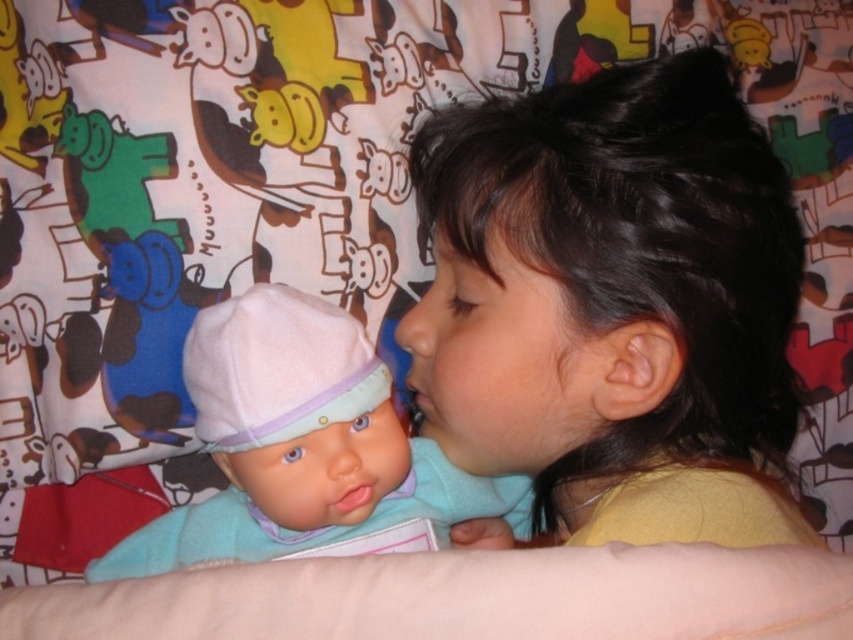
Question: Which point is closer to the camera?

Choices:
 (A) (468, 320)
 (B) (396, 472)

Answer: (A)

Question: Which object is closer to the camera taking this photo?

Choices:
 (A) smooth brown hair at upper right
 (B) matte pink fabric doll at left

Answer: (A)

Question: Can you confirm if smooth brown hair at upper right is smaller than matte pink fabric doll at left?

Choices:
 (A) no
 (B) yes

Answer: (A)

Question: Is smooth brown hair at upper right below matte pink fabric doll at left?

Choices:
 (A) yes
 (B) no

Answer: (B)

Question: Can you confirm if smooth brown hair at upper right is positioned to the left of matte pink fabric doll at left?

Choices:
 (A) no
 (B) yes

Answer: (A)

Question: Among these points, which one is nearest to the camera?

Choices:
 (A) (756, 125)
 (B) (270, 342)

Answer: (B)